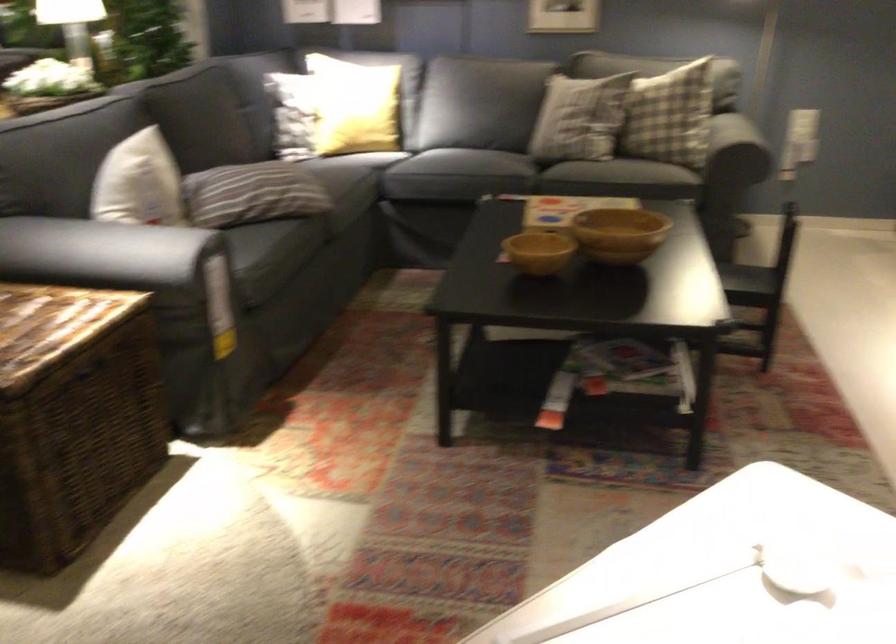
What do you see at coordinates (754, 306) in the screenshot? This screenshot has width=896, height=644. I see `the black chair sitting surface` at bounding box center [754, 306].